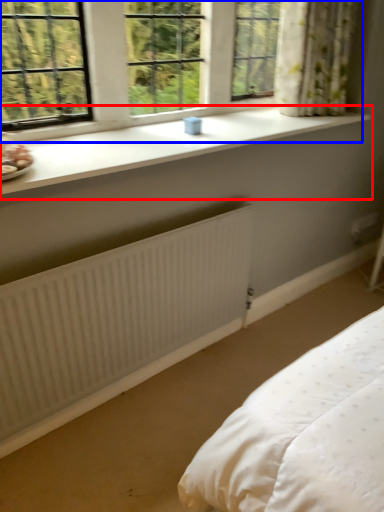
Question: Among these objects, which one is farthest to the camera, window sill (highlighted by a red box) or window (highlighted by a blue box)?

Choices:
 (A) window sill
 (B) window

Answer: (B)